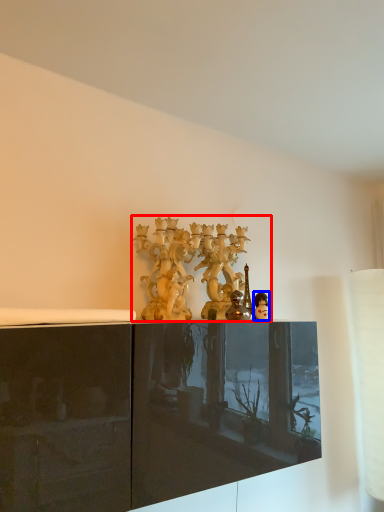
Question: Among these objects, which one is nearest to the camera, collection (highlighted by a red box) or person (highlighted by a blue box)?

Choices:
 (A) collection
 (B) person

Answer: (B)